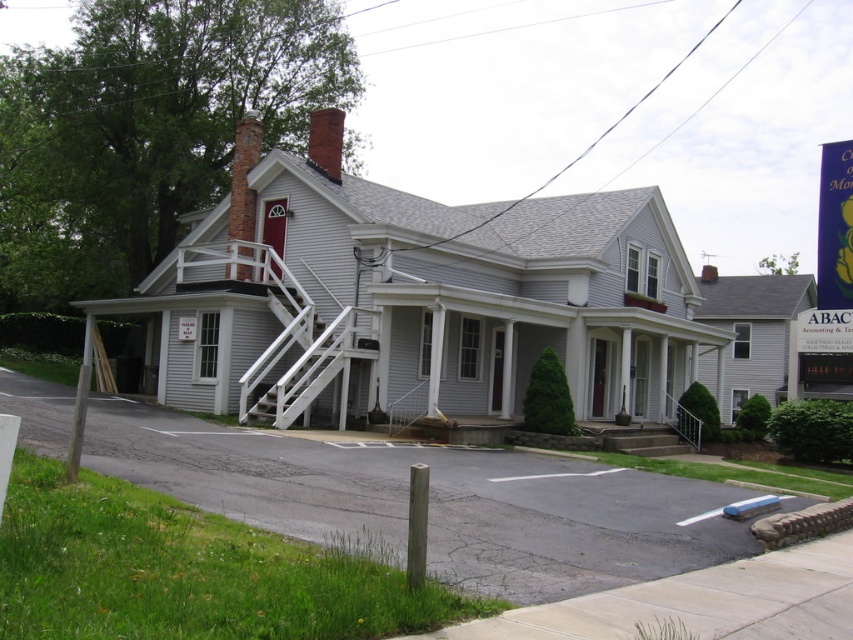
You are a delivery person trying to reach the front door of the house. You see the white wooden staircase at center and the brown wooden post at lower center. Which object should you approach first to reach the front door?

The brown wooden post at lower center should be approached first since the white wooden staircase at center is located above it, meaning the post is closer to the delivery person and the staircase is higher up.

Looking at this image, you are standing in front of the house and looking at the two points marked on the image. Which point, point (433, 406) or point (238, 240), is closer to you?

Point (433, 406) is closer to the camera than point (238, 240).

You are a delivery person trying to reach the front door of the house. You notice a white wooden staircase at center and a brown wooden post at lower center. Which object is taller and would require more effort to climb over?

The white wooden staircase at center is taller than the brown wooden post at lower center, so it would require more effort to climb over.